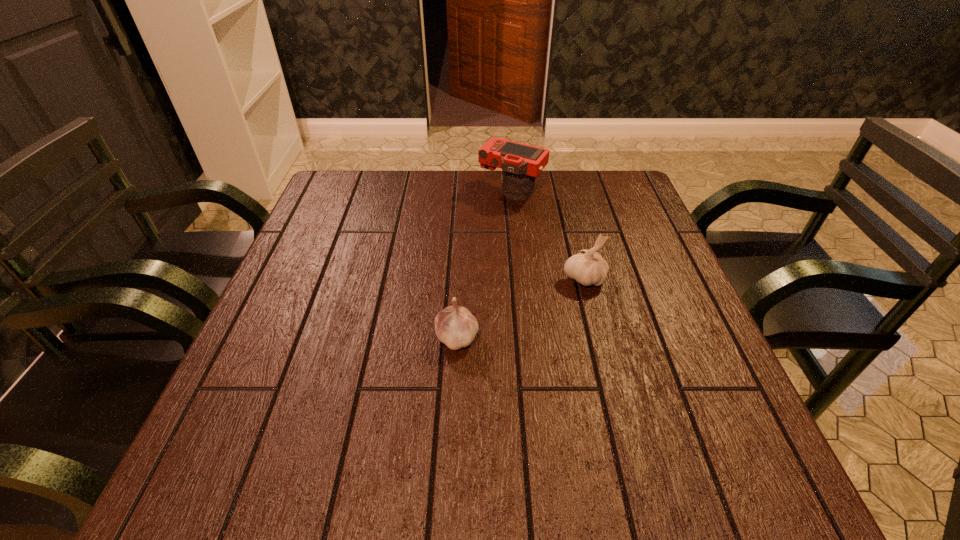
Where is `vacant space at the near edge`? The width and height of the screenshot is (960, 540). vacant space at the near edge is located at coordinates (500, 450).

This screenshot has width=960, height=540. I want to click on free space at the left edge of the desktop, so click(308, 262).

Find the location of a particular element. vacant space at the right edge of the desktop is located at coordinates (623, 258).

The width and height of the screenshot is (960, 540). In the image, there is a desktop. What are the coordinates of `vacant space at the far left corner` in the screenshot? It's located at (332, 188).

Identify the location of blank space at the near left corner of the desktop. The image size is (960, 540). (180, 496).

This screenshot has height=540, width=960. In the image, there is a desktop. What are the coordinates of `blank space at the far right corner` in the screenshot? It's located at (588, 180).

Locate an element on the screen. Image resolution: width=960 pixels, height=540 pixels. vacant area that lies between the nearest object and the farthest object is located at coordinates (485, 264).

The height and width of the screenshot is (540, 960). What are the coordinates of `free space between the nearer garlic and the farthest object` in the screenshot? It's located at (485, 264).

This screenshot has height=540, width=960. What are the coordinates of `vacant space that is in between the farther garlic and the left garlic` in the screenshot? It's located at (520, 308).

Identify the location of free spot between the nearest object and the right garlic. Image resolution: width=960 pixels, height=540 pixels. (520, 308).